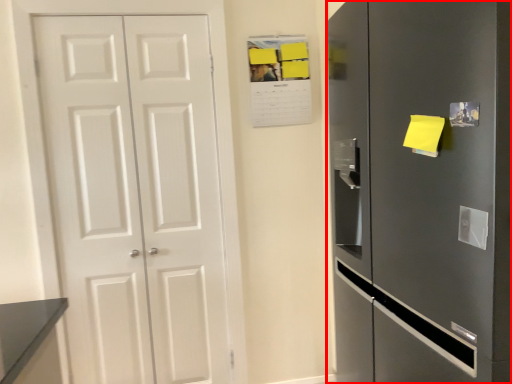
Question: Where is refrigerator (annotated by the red box) located in relation to door in the image?

Choices:
 (A) right
 (B) left

Answer: (A)